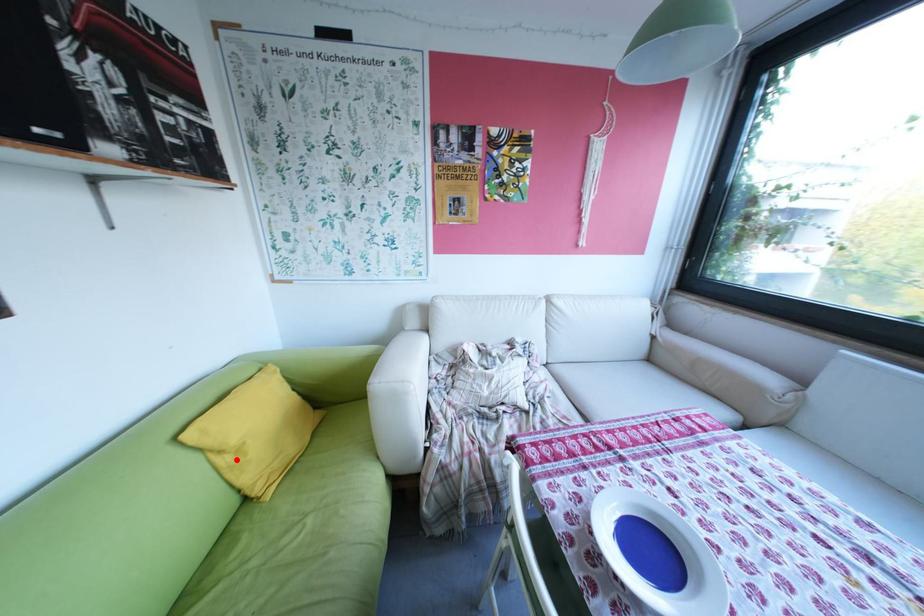
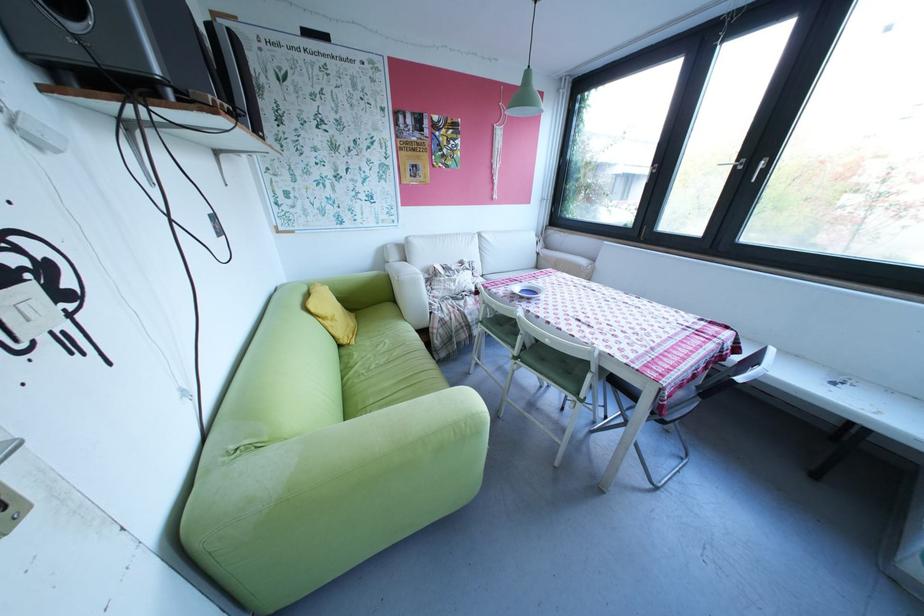
Question: I am providing you with two images of the same scene from different viewpoints. Given a red point in image1, look at the same physical point in image2. Is it:

Choices:
 (A) Closer to the viewpoint
 (B) Farther from the viewpoint

Answer: (A)